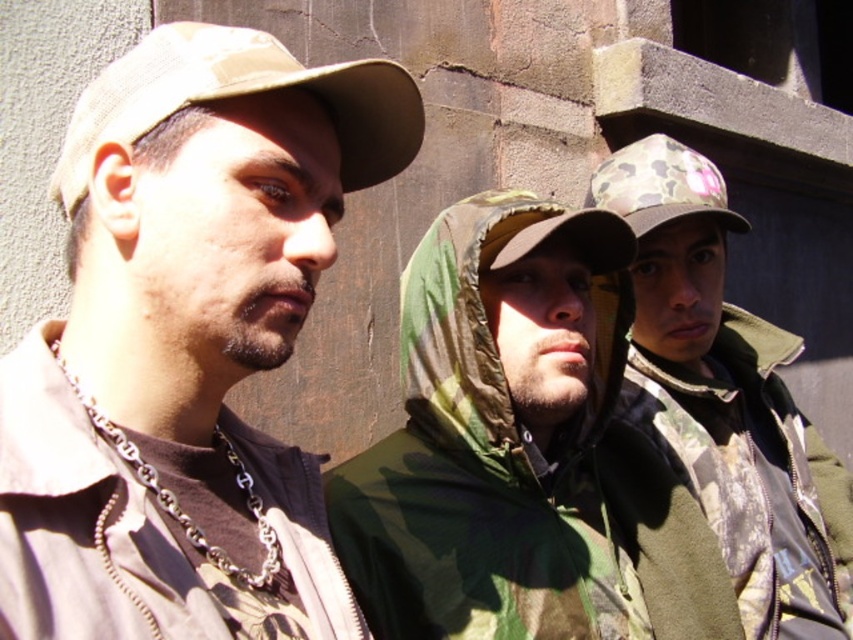
What do you see at coordinates (498, 435) in the screenshot? The width and height of the screenshot is (853, 640). I see `camouflage fabric jacket at center` at bounding box center [498, 435].

Which is more to the right, camouflage fabric jacket at center or camouflage fabric baseball cap at left?

From the viewer's perspective, camouflage fabric jacket at center appears more on the right side.

Is point (399, 525) positioned in front of point (292, 61)?

No, (399, 525) is behind (292, 61).

Identify the location of camouflage fabric jacket at center. The image size is (853, 640). (498, 435).

Between point (172, 29) and point (691, 612), which one is positioned in front?

Point (172, 29) is more forward.

Between matte khaki cap at center and camo fabric jacket at center, which one has more height?

camo fabric jacket at center is taller.

Which is behind, point (119, 579) or point (773, 461)?

The point (773, 461) is more distant.

Locate an element on the screen. matte khaki cap at center is located at coordinates (186, 344).

What do you see at coordinates (717, 422) in the screenshot? I see `camo fabric jacket at center` at bounding box center [717, 422].

Is camo fabric jacket at center to the right of camouflage fabric baseball cap at left from the viewer's perspective?

Indeed, camo fabric jacket at center is positioned on the right side of camouflage fabric baseball cap at left.

The height and width of the screenshot is (640, 853). Describe the element at coordinates (717, 422) in the screenshot. I see `camo fabric jacket at center` at that location.

What are the coordinates of `camo fabric jacket at center` in the screenshot? It's located at click(x=717, y=422).